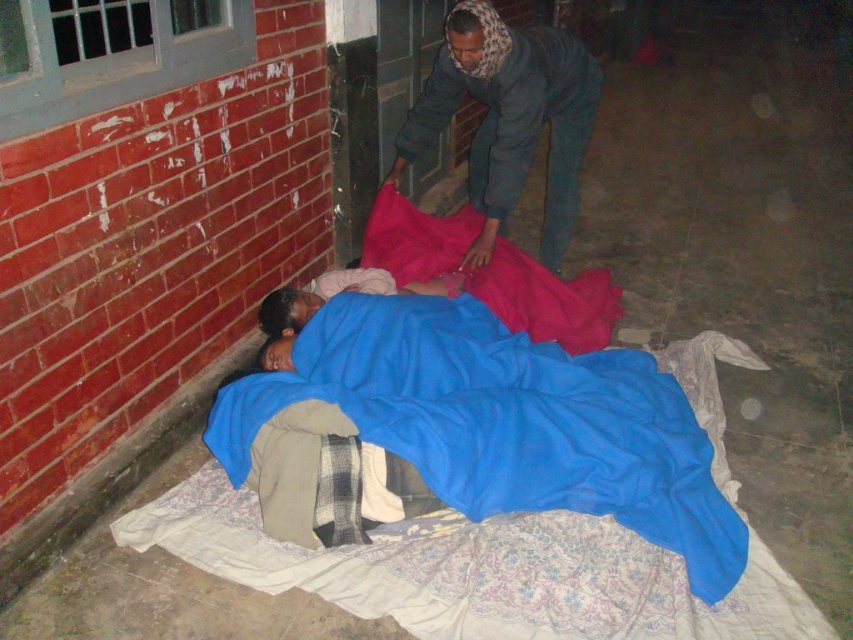
Question: Does blue fabric at lower left appear over dark gray fabric at upper center?

Choices:
 (A) no
 (B) yes

Answer: (A)

Question: Is dark gray fabric at upper center to the left of matte pink fabric at center from the viewer's perspective?

Choices:
 (A) yes
 (B) no

Answer: (B)

Question: Can you confirm if blue fabric at lower left is wider than matte pink fabric at center?

Choices:
 (A) no
 (B) yes

Answer: (B)

Question: Which object appears closest to the camera in this image?

Choices:
 (A) blue fabric at lower left
 (B) dark gray fabric at upper center
 (C) matte pink fabric at center

Answer: (A)

Question: Which point appears closest to the camera in this image?

Choices:
 (A) (727, 566)
 (B) (466, 72)

Answer: (A)

Question: Which object is farther from the camera taking this photo?

Choices:
 (A) blue fabric at lower left
 (B) matte pink fabric at center
 (C) dark gray fabric at upper center

Answer: (B)